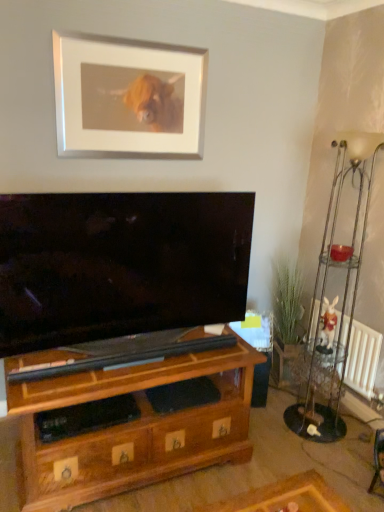
What is the approximate width of metallic silver side table at right?

metallic silver side table at right is 2.25 inches in width.

Image resolution: width=384 pixels, height=512 pixels. What do you see at coordinates (318, 398) in the screenshot?
I see `metallic silver side table at right` at bounding box center [318, 398].

Describe the element at coordinates (128, 98) in the screenshot. Image resolution: width=384 pixels, height=512 pixels. I see `white matte picture frame at upper center` at that location.

The height and width of the screenshot is (512, 384). Describe the element at coordinates (134, 428) in the screenshot. I see `brown wood shelf at lower left` at that location.

Where is `brown wood shelf at lower left`? The image size is (384, 512). brown wood shelf at lower left is located at coordinates (134, 428).

At what (x,y) coordinates should I click in order to perform the action: click on metallic silver side table at right. Please return your answer as a coordinate pair (x, y). This screenshot has height=512, width=384. Looking at the image, I should click on (318, 398).

Who is taller, metallic silver floor lamp at right or brown wood shelf at lower left?

Standing taller between the two is metallic silver floor lamp at right.

Who is bigger, metallic silver floor lamp at right or brown wood shelf at lower left?

metallic silver floor lamp at right.

Based on the photo, is metallic silver floor lamp at right further to camera compared to brown wood shelf at lower left?

That is True.

Is white matte picture frame at upper center not near metallic silver floor lamp at right?

That's right, there is a large distance between white matte picture frame at upper center and metallic silver floor lamp at right.

From the image's perspective, who appears lower, white matte picture frame at upper center or metallic silver floor lamp at right?

metallic silver floor lamp at right appears lower in the image.

Between point (142, 157) and point (341, 161), which one is positioned behind?

The point (341, 161) is farther from the camera.

Is white matte picture frame at upper center facing away from metallic silver floor lamp at right?

No, white matte picture frame at upper center is not facing away from metallic silver floor lamp at right.

Considering the sizes of metallic silver floor lamp at right and white radiator at lower right in the image, is metallic silver floor lamp at right wider or thinner than white radiator at lower right?

Clearly, metallic silver floor lamp at right has more width compared to white radiator at lower right.

Considering the relative positions of metallic silver floor lamp at right and white radiator at lower right in the image provided, is metallic silver floor lamp at right in front of white radiator at lower right?

Yes, metallic silver floor lamp at right is in front of white radiator at lower right.

From a real-world perspective, which is physically below, metallic silver floor lamp at right or white radiator at lower right?

In real-world perspective, white radiator at lower right is lower.

How different are the orientations of metallic silver floor lamp at right and white radiator at lower right in degrees?

The angular difference between metallic silver floor lamp at right and white radiator at lower right is 41.9 degrees.

From a real-world perspective, which object stands above the other?

white plush rabbit at right.

From the image's perspective, between white plush rabbit at right and white radiator at lower right, which one is located above?

white plush rabbit at right is shown above in the image.

Consider the image. Is white plush rabbit at right at the right side of white radiator at lower right?

Incorrect, white plush rabbit at right is not on the right side of white radiator at lower right.

This screenshot has width=384, height=512. Find the location of `lamp above the white radiator at lower right (from the image's perspective)`. lamp above the white radiator at lower right (from the image's perspective) is located at coordinates (343, 295).

Which of these two, white radiator at lower right or metallic silver floor lamp at right, is thinner?

With smaller width is white radiator at lower right.

Does white radiator at lower right have a larger size compared to metallic silver floor lamp at right?

No.

Which point is more distant from viewer, (370, 383) or (327, 383)?

Positioned behind is point (327, 383).

From a real-world perspective, which object stands above the other?

metallic silver floor lamp at right.

Is brown wood shelf at lower left with metallic silver floor lamp at right?

No, brown wood shelf at lower left is not beside metallic silver floor lamp at right.

Which is in front, point (68, 353) or point (342, 430)?

The point (68, 353) is closer to the camera.

How different are the orientations of brown wood shelf at lower left and metallic silver floor lamp at right in degrees?

brown wood shelf at lower left and metallic silver floor lamp at right are facing 132 degrees away from each other.

Between metallic silver side table at right and brown wood shelf at lower left, which one has larger width?

brown wood shelf at lower left.

How much distance is there between metallic silver side table at right and brown wood shelf at lower left?

metallic silver side table at right is 33.22 inches away from brown wood shelf at lower left.

Is metallic silver side table at right taller than brown wood shelf at lower left?

Correct, metallic silver side table at right is much taller as brown wood shelf at lower left.

Is metallic silver side table at right in front of or behind brown wood shelf at lower left in the image?

metallic silver side table at right is positioned farther from the viewer than brown wood shelf at lower left.

Locate an element on the screen. This screenshot has width=384, height=512. lamp located above the brown wood shelf at lower left (from the image's perspective) is located at coordinates 343,295.

Locate an element on the screen. This screenshot has width=384, height=512. lamp on the right of the white matte picture frame at upper center is located at coordinates (343, 295).

When comparing their distances from metallic silver side table at right, does brown wood shelf at lower left or white plush rabbit at right seem further?

Among the two, brown wood shelf at lower left is located further to metallic silver side table at right.

Estimate the real-world distances between objects in this image. Which object is closer to metallic silver floor lamp at right, metallic silver side table at right or white matte picture frame at upper center?

metallic silver side table at right.

From the image, which object appears to be farther from brown wood shelf at lower left, white matte picture frame at upper center or white radiator at lower right?

Among the two, white matte picture frame at upper center is located further to brown wood shelf at lower left.

Based on their spatial positions, is white radiator at lower right or white matte picture frame at upper center closer to metallic silver floor lamp at right?

white radiator at lower right.

Looking at the image, which one is located further to white matte picture frame at upper center, brown wood shelf at lower left or white plush rabbit at right?

Based on the image, white plush rabbit at right appears to be further to white matte picture frame at upper center.

From the image, which object appears to be nearer to white radiator at lower right, metallic silver side table at right or metallic silver floor lamp at right?

metallic silver floor lamp at right lies closer to white radiator at lower right than the other object.

Looking at the image, which one is located closer to metallic silver side table at right, metallic silver floor lamp at right or white plush rabbit at right?

metallic silver floor lamp at right is closer to metallic silver side table at right.

Consider the image. Estimate the real-world distances between objects in this image. Which object is further from brown wood shelf at lower left, metallic silver side table at right or white plush rabbit at right?

Based on the image, white plush rabbit at right appears to be further to brown wood shelf at lower left.

You are a GUI agent. You are given a task and a screenshot of the screen. Output one action in this format:
    pyautogui.click(x=<x>, y=<y>)
    Task: Click on the radiator that lies between metallic silver floor lamp at right and metallic silver side table at right from top to bottom
    The width and height of the screenshot is (384, 512).
    Given the screenshot: What is the action you would take?
    pyautogui.click(x=363, y=359)

Identify the location of side table between white matte picture frame at upper center and brown wood shelf at lower left in the vertical direction. This screenshot has width=384, height=512. (318, 398).

Where is `lamp between brown wood shelf at lower left and white radiator at lower right from front to back`? This screenshot has height=512, width=384. lamp between brown wood shelf at lower left and white radiator at lower right from front to back is located at coordinates (343, 295).

Identify the location of radiator located between brown wood shelf at lower left and white plush rabbit at right in the depth direction. (363, 359).